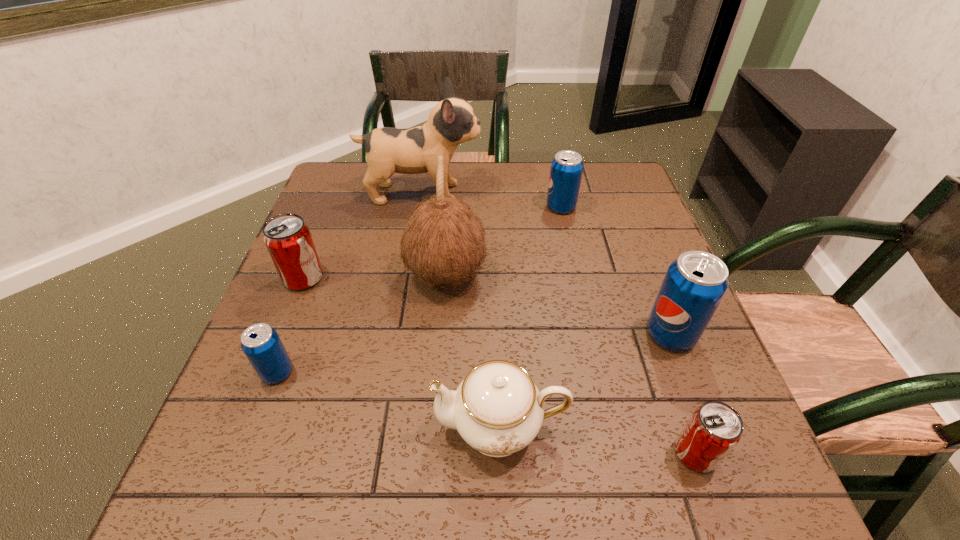
The width and height of the screenshot is (960, 540). I want to click on vacant region at the far edge of the desktop, so (x=539, y=165).

Locate an element on the screen. free space at the left edge of the desktop is located at coordinates (249, 372).

At what (x,y) coordinates should I click in order to perform the action: click on free space at the right edge of the desktop. Please return your answer as a coordinate pair (x, y). Looking at the image, I should click on (679, 399).

In order to click on blank space at the far left corner of the desktop in this screenshot , I will do `click(352, 166)`.

Locate an element on the screen. This screenshot has width=960, height=540. vacant space at the far right corner is located at coordinates (628, 174).

Where is `vacant space that's between the left red pop soda and the smallest blue pop soda`? vacant space that's between the left red pop soda and the smallest blue pop soda is located at coordinates (290, 325).

Find the location of a particular element. free space between the fourth nearest pop soda and the chinaware is located at coordinates (402, 352).

Locate an element on the screen. free space between the second biggest blue pop soda and the chinaware is located at coordinates (531, 316).

Locate an element on the screen. This screenshot has height=540, width=960. vacant region between the coconut and the right red pop soda is located at coordinates (571, 364).

You are a GUI agent. You are given a task and a screenshot of the screen. Output one action in this format:
    pyautogui.click(x=<x>, y=<y>)
    Task: Click on the free point between the farther red pop soda and the puppy
    This screenshot has width=960, height=540.
    Given the screenshot: What is the action you would take?
    pyautogui.click(x=362, y=236)